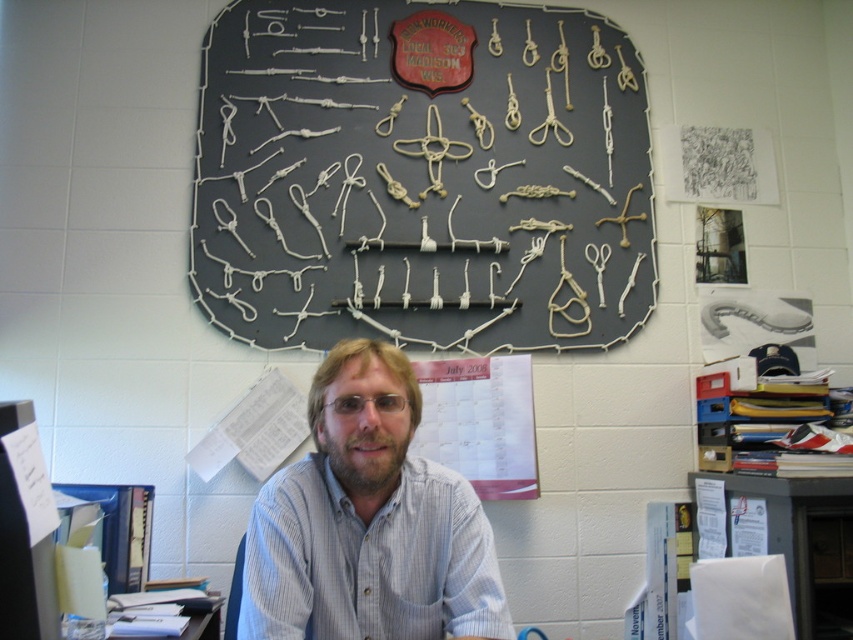
Between black fabric at upper center and blue striped shirt at center, which one has more height?

black fabric at upper center is taller.

Who is more forward, (196,168) or (288,580)?

Point (288,580)

Between point (282, 292) and point (321, 497), which one is positioned behind?

Positioned behind is point (282, 292).

Locate an element on the screen. This screenshot has width=853, height=640. black fabric at upper center is located at coordinates (421, 176).

Is point (334, 449) positioned behind point (827, 516)?

No, (334, 449) is in front of (827, 516).

Is point (432, 632) more distant than point (824, 504)?

That is False.

At what (x,y) coordinates should I click in order to perform the action: click on blue striped shirt at center. Please return your answer as a coordinate pair (x, y). Looking at the image, I should click on (368, 522).

Does blue striped shirt at center appear over white paper at lower left?

Yes, blue striped shirt at center is above white paper at lower left.

Which is in front, point (309, 531) or point (194, 620)?

Point (309, 531) is more forward.

Does point (427, 572) come closer to viewer compared to point (134, 628)?

Yes.

In order to click on blue striped shirt at center in this screenshot , I will do `click(368, 522)`.